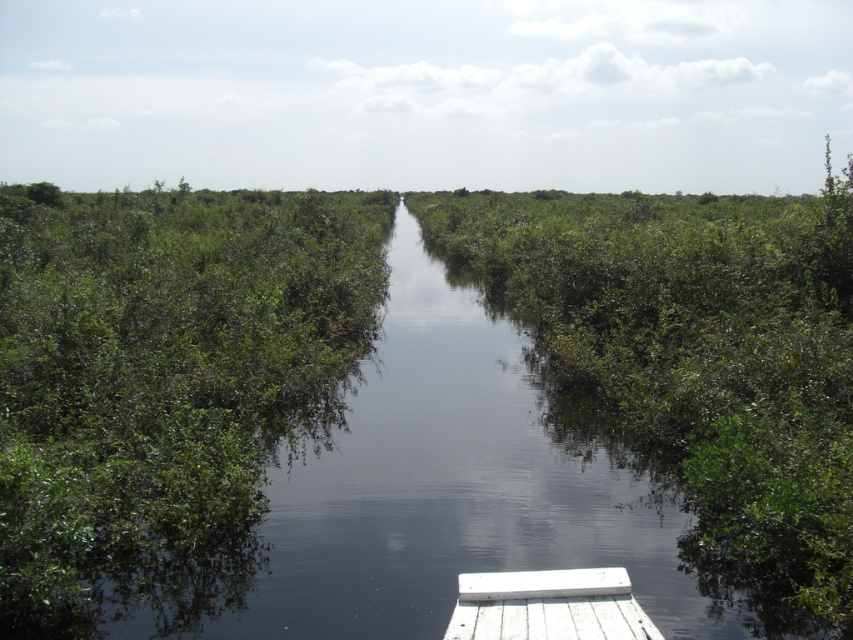
The height and width of the screenshot is (640, 853). What do you see at coordinates (160, 368) in the screenshot?
I see `green leafy river at center` at bounding box center [160, 368].

Can you confirm if green leafy river at center is shorter than white weathered wood dock at lower center?

In fact, green leafy river at center may be taller than white weathered wood dock at lower center.

Based on the photo, who is more distant from viewer, (221, 396) or (651, 637)?

Positioned behind is point (221, 396).

The image size is (853, 640). I want to click on green leafy river at center, so click(x=160, y=368).

Does green leafy river at center appear on the right side of green leafy shrubs at left?

Yes, green leafy river at center is to the right of green leafy shrubs at left.

Between point (10, 225) and point (119, 333), which one is positioned behind?

Point (10, 225)

Does point (28, 438) come closer to viewer compared to point (339, 280)?

Yes, it is.

Where is `green leafy river at center`? This screenshot has width=853, height=640. green leafy river at center is located at coordinates (160, 368).

Consider the image. Does green leafy shrubs at left have a greater width compared to white weathered wood dock at lower center?

Indeed, green leafy shrubs at left has a greater width compared to white weathered wood dock at lower center.

Between green leafy shrubs at left and white weathered wood dock at lower center, which one appears on the right side from the viewer's perspective?

From the viewer's perspective, white weathered wood dock at lower center appears more on the right side.

Describe the element at coordinates (161, 369) in the screenshot. I see `green leafy shrubs at left` at that location.

Locate an element on the screen. The width and height of the screenshot is (853, 640). green leafy shrubs at left is located at coordinates (161, 369).